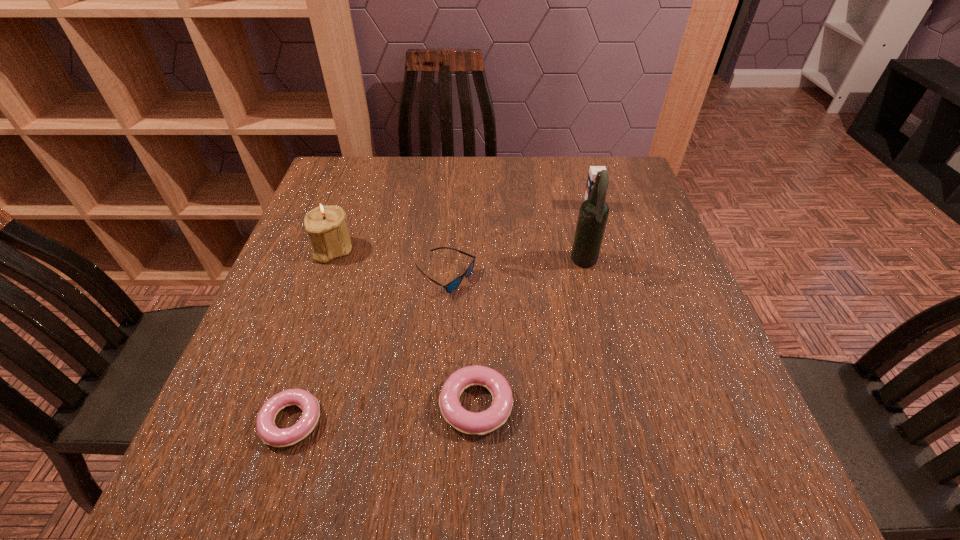
Locate an element on the screen. The width and height of the screenshot is (960, 540). free space at the far edge of the desktop is located at coordinates point(460,189).

In the image, there is a desktop. Where is `vacant space at the near edge`? The height and width of the screenshot is (540, 960). vacant space at the near edge is located at coordinates (540, 397).

Identify the location of vacant space at the left edge of the desktop. Image resolution: width=960 pixels, height=540 pixels. (322, 308).

Image resolution: width=960 pixels, height=540 pixels. In the image, there is a desktop. What are the coordinates of `free space at the right edge` in the screenshot? It's located at (717, 354).

Find the location of a particular element. This screenshot has height=540, width=960. free point at the far left corner is located at coordinates (347, 176).

In order to click on vacant space at the near left corner in this screenshot , I will do `click(231, 414)`.

You are a GUI agent. You are given a task and a screenshot of the screen. Output one action in this format:
    pyautogui.click(x=<x>, y=<y>)
    Task: Click on the free space at the far right corner of the desktop
    
    Given the screenshot: What is the action you would take?
    pyautogui.click(x=586, y=182)

I want to click on free space at the near right corner, so click(x=736, y=415).

This screenshot has height=540, width=960. Find the location of `free space between the chocolate milk and the sunglasses`. free space between the chocolate milk and the sunglasses is located at coordinates (518, 241).

Find the location of a particular element. Image resolution: width=960 pixels, height=540 pixels. free spot between the taller doughnut and the candle_holder is located at coordinates (404, 327).